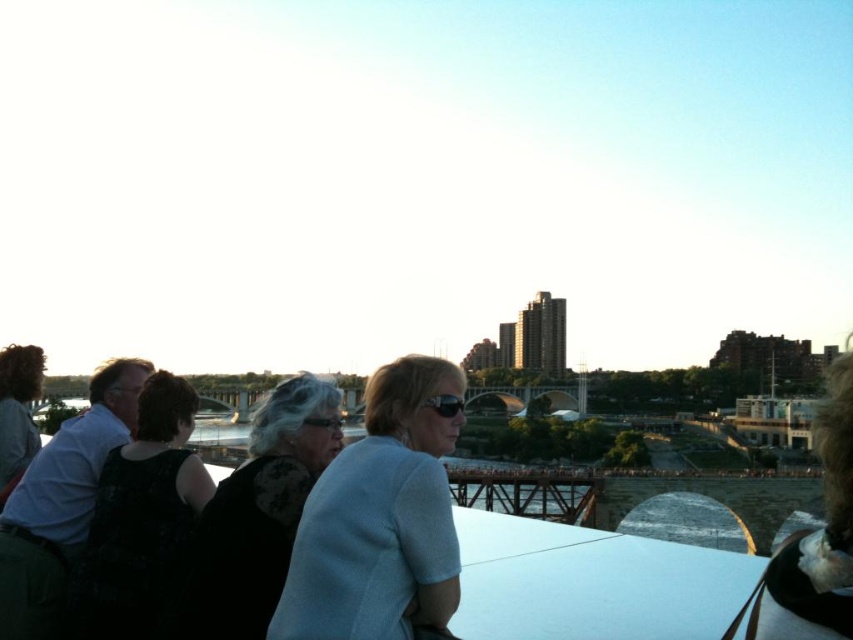
You are a photographer trying to capture a closeup of the black plastic goggles at center and the clear plastic goggles at center. Which goggles are located to the right of the other?

The black plastic goggles at center is positioned on the right side of clear plastic goggles at center.

You are a photographer trying to capture a closeup of the black plastic goggles at center without including the light blue fabric at center in the frame. Based on their positions, is this possible?

The light blue fabric at center is located below the black plastic goggles at center, so if you position your camera to focus on the goggles while avoiding the area directly beneath them, you can capture the closeup without including the fabric.